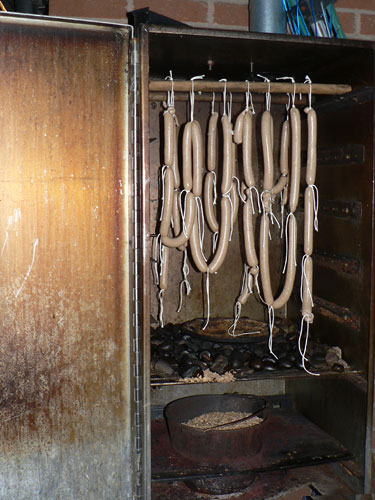
The height and width of the screenshot is (500, 375). In order to click on door in this screenshot , I will do `click(70, 211)`.